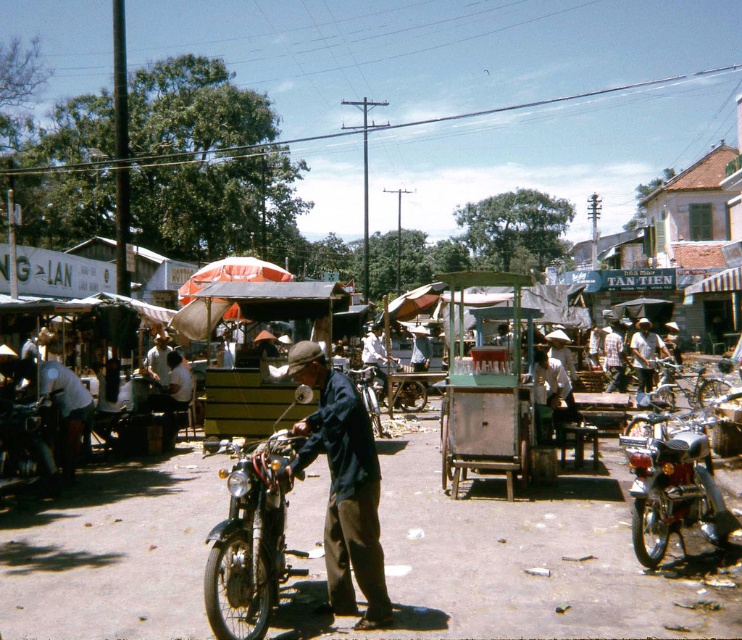
You are a tourist in the market and want to take a photo of both the wooden cart at center and the shiny chrome motorcycle at right. However, you can only position yourself in a way that one object is in the foreground and the other is in the background. Which object should be in the foreground to ensure both are visible in the photo?

The wooden cart at center should be placed in the foreground because it is already positioned in front of the shiny chrome motorcycle at right, allowing both to be captured in the photo without obstruction.

You are standing at the point with coordinates point (214, 625) and want to walk to the point with coordinates point (151, 628). Is the destination point behind you or in front of you?

The destination point (151, 628) is behind point (214, 625), so it is behind you.

You are a street vendor who wants to place a new stand between the wooden cart at center and the dark blue fabric at center. Based on their sizes, which one should you place closer to the edge to ensure your stand fits in the space?

The wooden cart at center is wider than the dark blue fabric at center, so you should place the wooden cart at center closer to the edge to leave enough space for the new stand.